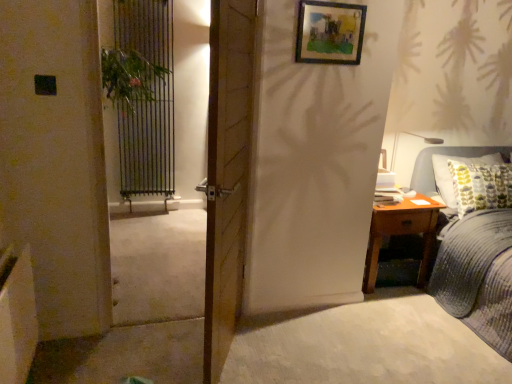
Question: Is blue corduroy bed at right to the right of green leafy plant at left from the viewer's perspective?

Choices:
 (A) yes
 (B) no

Answer: (A)

Question: Is blue corduroy bed at right oriented away from green leafy plant at left?

Choices:
 (A) no
 (B) yes

Answer: (A)

Question: Can you confirm if blue corduroy bed at right is thinner than green leafy plant at left?

Choices:
 (A) yes
 (B) no

Answer: (B)

Question: From a real-world perspective, does blue corduroy bed at right stand above green leafy plant at left?

Choices:
 (A) yes
 (B) no

Answer: (B)

Question: Does blue corduroy bed at right have a larger size compared to green leafy plant at left?

Choices:
 (A) yes
 (B) no

Answer: (A)

Question: Considering the positions of point (343, 28) and point (395, 225), is point (343, 28) closer or farther from the camera than point (395, 225)?

Choices:
 (A) closer
 (B) farther

Answer: (A)

Question: Is wooden framed artwork at upper center situated inside brown wooden nightstand at right or outside?

Choices:
 (A) inside
 (B) outside

Answer: (B)

Question: Relative to brown wooden nightstand at right, is wooden framed artwork at upper center in front or behind?

Choices:
 (A) front
 (B) behind

Answer: (A)

Question: From their relative heights in the image, would you say wooden framed artwork at upper center is taller or shorter than brown wooden nightstand at right?

Choices:
 (A) short
 (B) tall

Answer: (A)

Question: Relative to wooden framed artwork at upper center, is green leafy plant at left in front or behind?

Choices:
 (A) behind
 (B) front

Answer: (B)

Question: In terms of width, does green leafy plant at left look wider or thinner when compared to wooden framed artwork at upper center?

Choices:
 (A) thin
 (B) wide

Answer: (B)

Question: In terms of size, does green leafy plant at left appear bigger or smaller than wooden framed artwork at upper center?

Choices:
 (A) small
 (B) big

Answer: (B)

Question: Is green leafy plant at left inside or outside of wooden framed artwork at upper center?

Choices:
 (A) outside
 (B) inside

Answer: (A)

Question: Would you say green leafy plant at left is inside or outside wooden door at center?

Choices:
 (A) inside
 (B) outside

Answer: (B)

Question: In terms of height, does green leafy plant at left look taller or shorter compared to wooden door at center?

Choices:
 (A) tall
 (B) short

Answer: (A)